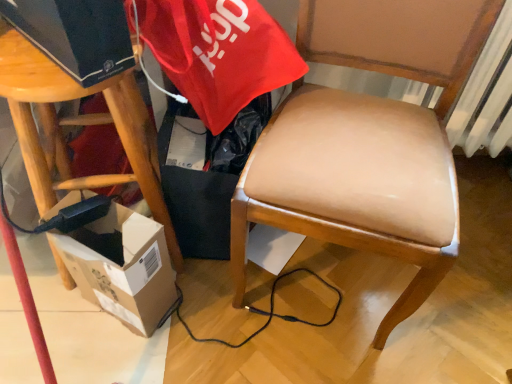
Identify the location of wooden stool at left. The height and width of the screenshot is (384, 512). (78, 125).

At what (x,y) coordinates should I click in order to perform the action: click on cardboard box at lower left. Please return your answer as a coordinate pair (x, y). The width and height of the screenshot is (512, 384). Looking at the image, I should click on (121, 267).

Measure the distance between point (275,209) and camera.

Point (275,209) is 31.14 inches away from camera.

Find the location of a particular element. leather-like tan chair at center is located at coordinates (368, 141).

Find the location of a particular element. This screenshot has width=512, height=384. wooden stool at left is located at coordinates (78, 125).

Consider the image. From the image's perspective, is wooden stool at left over leather-like tan chair at center?

No.

Is wooden stool at left located outside leather-like tan chair at center?

Absolutely, wooden stool at left is external to leather-like tan chair at center.

Is wooden stool at left shorter than leather-like tan chair at center?

Yes.

Is wooden stool at left positioned with its back to leather-like tan chair at center?

wooden stool at left is not turned away from leather-like tan chair at center.

Is cardboard box at lower left surrounding leather-like tan chair at center?

No, leather-like tan chair at center is not a part of cardboard box at lower left.

In the image, is cardboard box at lower left positioned in front of or behind leather-like tan chair at center?

cardboard box at lower left is behind leather-like tan chair at center.

Could you tell me if cardboard box at lower left is turned towards leather-like tan chair at center?

No, cardboard box at lower left is not facing towards leather-like tan chair at center.

Is cardboard box at lower left taller than leather-like tan chair at center?

No, cardboard box at lower left is not taller than leather-like tan chair at center.

In terms of size, does cardboard box at lower left appear bigger or smaller than wooden stool at left?

Considering their sizes, cardboard box at lower left takes up less space than wooden stool at left.

From a real-world perspective, which object stands above the other?

In real-world perspective, wooden stool at left is above.

Is point (135, 257) less distant than point (162, 202)?

Yes, it is in front of point (162, 202).

In the image, is wooden stool at left positioned in front of or behind cardboard box at lower left?

Visually, wooden stool at left is located in front of cardboard box at lower left.

Which is behind, point (46, 89) or point (54, 230)?

Point (54, 230)

Considering the sizes of wooden stool at left and cardboard box at lower left in the image, is wooden stool at left wider or thinner than cardboard box at lower left?

wooden stool at left is wider than cardboard box at lower left.

The width and height of the screenshot is (512, 384). I want to click on box below the wooden stool at left (from the image's perspective), so click(x=121, y=267).

From a real-world perspective, between leather-like tan chair at center and wooden stool at left, who is vertically lower?

wooden stool at left is physically lower.

Considering the relative sizes of leather-like tan chair at center and wooden stool at left in the image provided, is leather-like tan chair at center smaller than wooden stool at left?

No.

Find the location of a particular element. stool that appears behind the leather-like tan chair at center is located at coordinates (78, 125).

Can we say leather-like tan chair at center lies outside wooden stool at left?

Absolutely, leather-like tan chair at center is external to wooden stool at left.

Is leather-like tan chair at center next to cardboard box at lower left?

No, leather-like tan chair at center is not in contact with cardboard box at lower left.

Which object is further away from the camera, leather-like tan chair at center or cardboard box at lower left?

cardboard box at lower left is further away from the camera.

What's the angular difference between leather-like tan chair at center and cardboard box at lower left's facing directions?

0.42 degrees.

From a real-world perspective, who is located lower, leather-like tan chair at center or cardboard box at lower left?

cardboard box at lower left, from a real-world perspective.

At what (x,y) coordinates should I click in order to perform the action: click on chair on the right of the wooden stool at left. Please return your answer as a coordinate pair (x, y). The image size is (512, 384). Looking at the image, I should click on (368, 141).

Where is `box that is under the leather-like tan chair at center (from a real-world perspective)`? box that is under the leather-like tan chair at center (from a real-world perspective) is located at coordinates (121, 267).

Considering their positions, is leather-like tan chair at center positioned closer to wooden stool at left than cardboard box at lower left?

cardboard box at lower left is closer to wooden stool at left.

Based on their spatial positions, is cardboard box at lower left or leather-like tan chair at center further from wooden stool at left?

The object further to wooden stool at left is leather-like tan chair at center.

From the image, which object appears to be farther from cardboard box at lower left, leather-like tan chair at center or wooden stool at left?

leather-like tan chair at center is positioned further to the anchor cardboard box at lower left.

Looking at the image, which one is located closer to leather-like tan chair at center, cardboard box at lower left or wooden stool at left?

Among the two, cardboard box at lower left is located nearer to leather-like tan chair at center.

Considering their positions, is wooden stool at left positioned closer to leather-like tan chair at center than cardboard box at lower left?

Among the two, cardboard box at lower left is located nearer to leather-like tan chair at center.

Estimate the real-world distances between objects in this image. Which object is closer to cardboard box at lower left, wooden stool at left or leather-like tan chair at center?

Based on the image, wooden stool at left appears to be nearer to cardboard box at lower left.

I want to click on box situated between wooden stool at left and leather-like tan chair at center from left to right, so click(x=121, y=267).